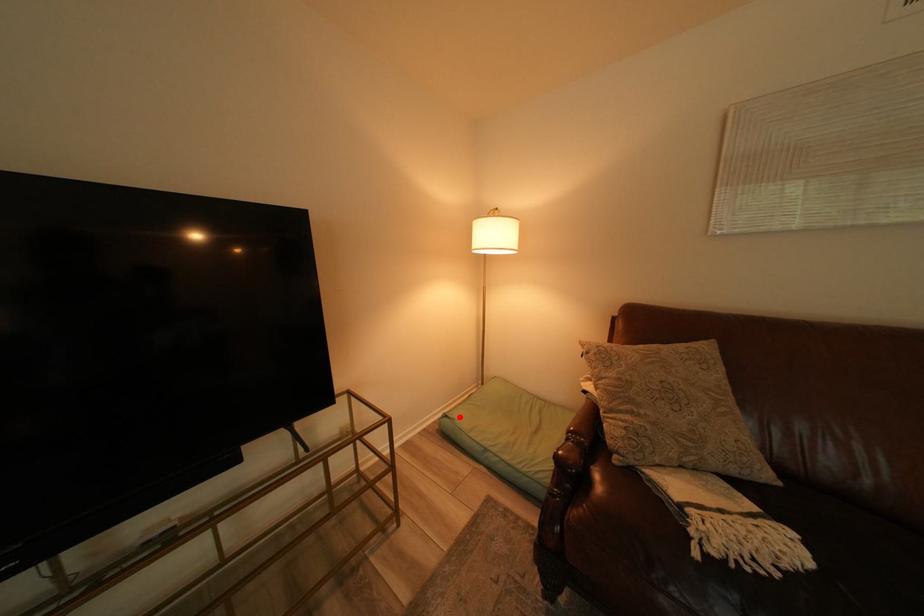
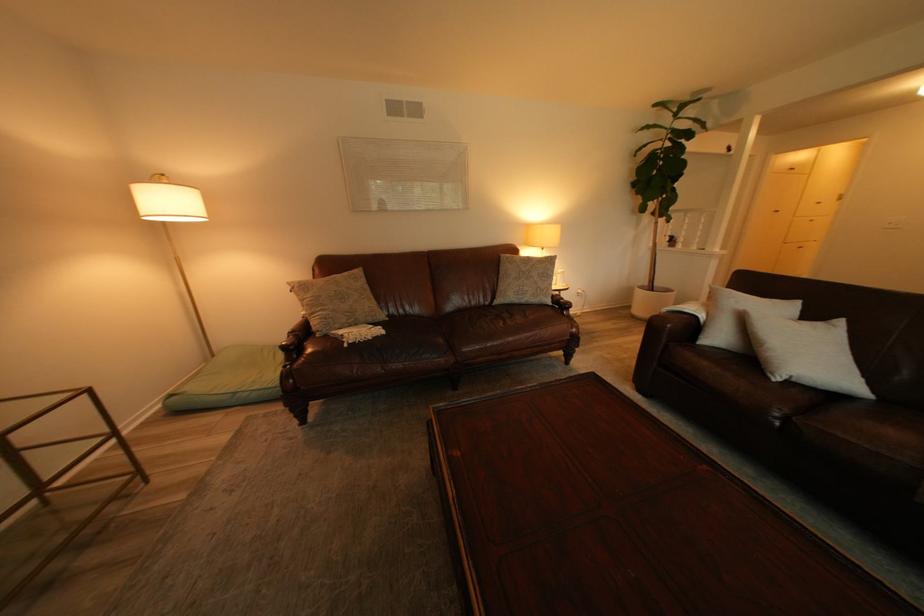
In the second image, find the point that corresponds to the highlighted location in the first image.

(186, 395)